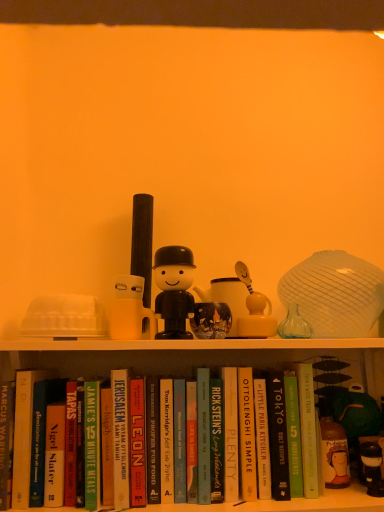
The width and height of the screenshot is (384, 512). What do you see at coordinates (189, 344) in the screenshot?
I see `white matte shelf at upper center` at bounding box center [189, 344].

What do you see at coordinates (203, 436) in the screenshot?
I see `hardcover book at center, which appears as the 6th paperback book when viewed from the right` at bounding box center [203, 436].

You are a GUI agent. You are given a task and a screenshot of the screen. Output one action in this format:
    pyautogui.click(x=<x>, y=<y>)
    Task: Click on the hardcover book at center, the 6th paperback book from the left
    The width and height of the screenshot is (384, 512).
    Given the screenshot: What is the action you would take?
    pyautogui.click(x=203, y=436)

Find the location of `green matte book at center, positioned as the eleventh paperback book in left-to-right order`. green matte book at center, positioned as the eleventh paperback book in left-to-right order is located at coordinates (308, 430).

What's the angular difference between matte glass mug at center, acting as the 2th toy starting from the left, and hardcover book at center, the eleventh paperback book viewed from the right,'s facing directions?

The facing directions of matte glass mug at center, acting as the 2th toy starting from the left, and hardcover book at center, the eleventh paperback book viewed from the right, are 1.26 degrees apart.

Can hardcover book at center, marked as the first paperback book in a left-to-right arrangement, be found inside matte glass mug at center, marked as the 1th toy in a right-to-left arrangement?

No, hardcover book at center, marked as the first paperback book in a left-to-right arrangement, is not a part of matte glass mug at center, marked as the 1th toy in a right-to-left arrangement.

From a real-world perspective, is matte glass mug at center, acting as the 2th toy starting from the left, above or below hardcover book at center, marked as the first paperback book in a left-to-right arrangement?

From a real-world perspective, matte glass mug at center, acting as the 2th toy starting from the left, is physically above hardcover book at center, marked as the first paperback book in a left-to-right arrangement.

Based on their sizes in the image, would you say matte glass mug at center, marked as the 1th toy in a right-to-left arrangement, is bigger or smaller than hardcover book at center, marked as the first paperback book in a left-to-right arrangement?

Considering their sizes, matte glass mug at center, marked as the 1th toy in a right-to-left arrangement, takes up less space than hardcover book at center, marked as the first paperback book in a left-to-right arrangement.

Do you think matte glass mug at center, marked as the 1th toy in a right-to-left arrangement, is within hardcover book at center, acting as the fourth paperback book starting from the right, or outside of it?

The correct answer is: outside.

Which object is thinner, matte glass mug at center, acting as the 2th toy starting from the left, or hardcover book at center, which is the 8th paperback book from left to right?

With smaller width is matte glass mug at center, acting as the 2th toy starting from the left.

What's the angular difference between matte glass mug at center, acting as the 2th toy starting from the left, and hardcover book at center, acting as the fourth paperback book starting from the right,'s facing directions?

They differ by 3.12 degrees in their facing directions.

Is matte glass mug at center, acting as the 2th toy starting from the left, next to hardcover book at center, acting as the fourth paperback book starting from the right?

No, matte glass mug at center, acting as the 2th toy starting from the left, is not next to hardcover book at center, acting as the fourth paperback book starting from the right.

Is hardcover book at center, which appears as the 8th paperback book when viewed from the right, far away from hardcover book at center, which ranks as the 5th paperback book in left-to-right order?

No, hardcover book at center, which appears as the 8th paperback book when viewed from the right, is in close proximity to hardcover book at center, which ranks as the 5th paperback book in left-to-right order.

Consider the image. In the image, is hardcover book at center, which appears as the 8th paperback book when viewed from the right, on the left side or the right side of hardcover book at center, which ranks as the 5th paperback book in left-to-right order?

Based on their positions, hardcover book at center, which appears as the 8th paperback book when viewed from the right, is located to the left of hardcover book at center, which ranks as the 5th paperback book in left-to-right order.

Is hardcover book at center, arranged as the 4th paperback book when viewed from the left, shorter than hardcover book at center, the 7th paperback book positioned from the right?

Incorrect, the height of hardcover book at center, arranged as the 4th paperback book when viewed from the left, does not fall short of that of hardcover book at center, the 7th paperback book positioned from the right.

Between point (130, 390) and point (153, 439), which one is positioned in front?

The point (153, 439) is in front.

From a real-world perspective, is hardcover book at center, the 3th paperback book from the left, positioned over hardcover book at center, marked as the first paperback book in a left-to-right arrangement, based on gravity?

Indeed, from a real-world perspective, hardcover book at center, the 3th paperback book from the left, stands above hardcover book at center, marked as the first paperback book in a left-to-right arrangement.

Can you confirm if hardcover book at center, the 3th paperback book from the left, is smaller than hardcover book at center, the eleventh paperback book viewed from the right?

No.

Considering the positions of objects hardcover book at center, marked as the ninth paperback book in a right-to-left arrangement, and hardcover book at center, the eleventh paperback book viewed from the right, in the image provided, who is more to the right, hardcover book at center, marked as the ninth paperback book in a right-to-left arrangement, or hardcover book at center, the eleventh paperback book viewed from the right,?

hardcover book at center, marked as the ninth paperback book in a right-to-left arrangement, is more to the right.

Can you confirm if hardcover book at center, acting as the fourth paperback book starting from the right, is bigger than green matte book at center, which ranks as the tenth paperback book in left-to-right order?

No.

Locate an element on the screen. paperback book that is the 2nd one when counting forward from the hardcover book at center, which is the 8th paperback book from left to right is located at coordinates (293, 434).

Based on the photo, between hardcover book at center, which is the 8th paperback book from left to right, and green matte book at center, which ranks as the second paperback book in right-to-left order, which one has larger width?

green matte book at center, which ranks as the second paperback book in right-to-left order.

Based on the photo, which is correct: hardcover book at center, which is the 8th paperback book from left to right, is inside green matte book at center, which ranks as the tenth paperback book in left-to-right order, or outside of it?

The correct answer is: outside.

From the image's perspective, is hardcover book at center, the 6th paperback book from the left, positioned above or below hardcover book at center, the 7th paperback book positioned from the right?

Clearly, from the image's perspective, hardcover book at center, the 6th paperback book from the left, is above hardcover book at center, the 7th paperback book positioned from the right.

Considering the positions of point (198, 394) and point (152, 426), is point (198, 394) closer or farther from the camera than point (152, 426)?

Point (198, 394) appears to be farther away from the viewer than point (152, 426).

How many degrees apart are the facing directions of hardcover book at center, the 6th paperback book from the left, and hardcover book at center, which ranks as the 5th paperback book in left-to-right order?

5.69 degrees separate the facing orientations of hardcover book at center, the 6th paperback book from the left, and hardcover book at center, which ranks as the 5th paperback book in left-to-right order.

From the picture: Are hardcover book at center, which appears as the 6th paperback book when viewed from the right, and hardcover book at center, which ranks as the 5th paperback book in left-to-right order, beside each other?

Yes, hardcover book at center, which appears as the 6th paperback book when viewed from the right, is in contact with hardcover book at center, which ranks as the 5th paperback book in left-to-right order.

Between hardcover book at center, which ranks as the 5th paperback book in left-to-right order, and matte yellow figurine at center, which one appears on the left side from the viewer's perspective?

Positioned to the left is hardcover book at center, which ranks as the 5th paperback book in left-to-right order.

Considering the sizes of objects hardcover book at center, the 7th paperback book positioned from the right, and matte yellow figurine at center in the image provided, who is smaller, hardcover book at center, the 7th paperback book positioned from the right, or matte yellow figurine at center?

Smaller between the two is matte yellow figurine at center.

Which point is more distant from viewer, (151,460) or (253,298)?

Positioned behind is point (253,298).

From the image's perspective, which object appears higher, hardcover book at center, the 7th paperback book positioned from the right, or matte yellow figurine at center?

matte yellow figurine at center appears higher in the image.

There is a matte glass mug at center, marked as the 1th toy in a right-to-left arrangement. Where is `the 4th paperback book below it (from a real-world perspective)`? The image size is (384, 512). the 4th paperback book below it (from a real-world perspective) is located at coordinates (23, 435).

At what (x,y) coordinates should I click in order to perform the action: click on the 1st toy positioned above the hardcover book at center, acting as the fourth paperback book starting from the right (from the image's perspective). Please return your answer as a coordinate pair (x, y). The width and height of the screenshot is (384, 512). Looking at the image, I should click on (211, 320).

Considering their positions, is matte glass mug at center, marked as the 1th toy in a right-to-left arrangement, positioned closer to white matte shelf at upper center than green matte book at center, which ranks as the second paperback book in right-to-left order?

Based on the image, matte glass mug at center, marked as the 1th toy in a right-to-left arrangement, appears to be nearer to white matte shelf at upper center.

Looking at the image, which one is located closer to hardcover book at center, the 6th paperback book from the left, green matte book at center, which ranks as the tenth paperback book in left-to-right order, or hardcover book at center, marked as the first paperback book in a left-to-right arrangement?

green matte book at center, which ranks as the tenth paperback book in left-to-right order, is positioned closer to the anchor hardcover book at center, the 6th paperback book from the left.

Which object lies nearer to the anchor point black matte figure at center, marked as the first toy in a left-to-right arrangement, hardcover book at center, the eleventh paperback book viewed from the right, or green matte book at center, which ranks as the second paperback book in right-to-left order?

The object closer to black matte figure at center, marked as the first toy in a left-to-right arrangement, is green matte book at center, which ranks as the second paperback book in right-to-left order.

Which object lies further to the anchor point white matte shelf at upper center, green matte book at center, which ranks as the tenth paperback book in left-to-right order, or hardcover book at center, which ranks as the 5th paperback book in left-to-right order?

green matte book at center, which ranks as the tenth paperback book in left-to-right order, lies further to white matte shelf at upper center than the other object.

Looking at the image, which one is located closer to white matte shelf at upper center, hardcover book at center, marked as the ninth paperback book in a right-to-left arrangement, or hardcover book at center, which appears as the 6th paperback book when viewed from the right?

hardcover book at center, which appears as the 6th paperback book when viewed from the right, lies closer to white matte shelf at upper center than the other object.

In the scene shown: Considering their positions, is hardcover book at center, which appears as the 6th paperback book when viewed from the right, positioned closer to green matte book at center, the first paperback book when ordered from right to left, than hardcover book at center, marked as the third paperback book in a right-to-left arrangement?

Among the two, hardcover book at center, marked as the third paperback book in a right-to-left arrangement, is located nearer to green matte book at center, the first paperback book when ordered from right to left.

Looking at the image, which one is located closer to hardcover book at center, marked as the ninth paperback book in a left-to-right arrangement, hardcover book at center, the 6th paperback book from the left, or hardcover book at center, which ranks as the 5th paperback book in left-to-right order?

hardcover book at center, the 6th paperback book from the left, is closer to hardcover book at center, marked as the ninth paperback book in a left-to-right arrangement.

Based on their spatial positions, is black matte figure at center, the 2th toy when ordered from right to left, or hardcover book at center, the second paperback book from the left, closer to matte white candle holder at center?

black matte figure at center, the 2th toy when ordered from right to left, is positioned closer to the anchor matte white candle holder at center.

The width and height of the screenshot is (384, 512). Find the location of `window sill between black matte figure at center, marked as the first toy in a left-to-right arrangement, and green matte book at center, positioned as the eleventh paperback book in left-to-right order, from top to bottom`. window sill between black matte figure at center, marked as the first toy in a left-to-right arrangement, and green matte book at center, positioned as the eleventh paperback book in left-to-right order, from top to bottom is located at coordinates (189, 344).

The width and height of the screenshot is (384, 512). Identify the location of window sill between matte white candle holder at center and hardcover book at center, which appears as the 6th paperback book when viewed from the right, in the up-down direction. (189, 344).

I want to click on candle holder between hardcover book at center, marked as the first paperback book in a left-to-right arrangement, and white matte shelf at upper center, in the horizontal direction, so click(130, 310).

The height and width of the screenshot is (512, 384). Find the location of `window sill situated between hardcover book at center, arranged as the 4th paperback book when viewed from the left, and hardcover book at center, marked as the third paperback book in a right-to-left arrangement, from left to right`. window sill situated between hardcover book at center, arranged as the 4th paperback book when viewed from the left, and hardcover book at center, marked as the third paperback book in a right-to-left arrangement, from left to right is located at coordinates (189, 344).